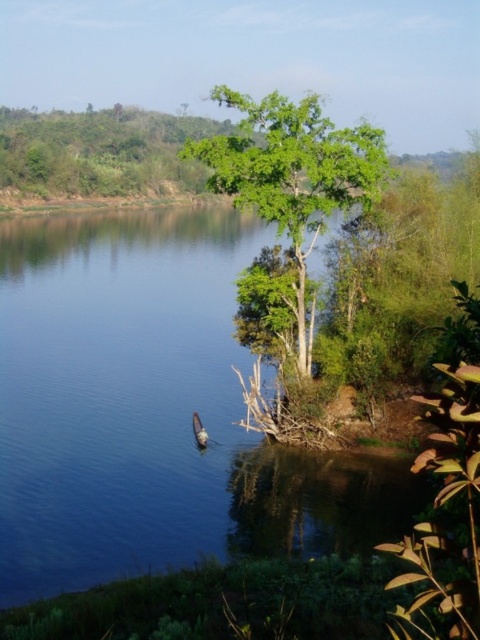
Is blue smooth water at center below green leafy tree at center?

Incorrect, blue smooth water at center is not positioned below green leafy tree at center.

Measure the distance between blue smooth water at center and camera.

The distance of blue smooth water at center from camera is 61.96 feet.

This screenshot has height=640, width=480. Find the location of `blue smooth water at center`. blue smooth water at center is located at coordinates (149, 410).

You are a GUI agent. You are given a task and a screenshot of the screen. Output one action in this format:
    pyautogui.click(x=<x>, y=<y>)
    Task: Click on the blue smooth water at center
    
    Given the screenshot: What is the action you would take?
    pyautogui.click(x=149, y=410)